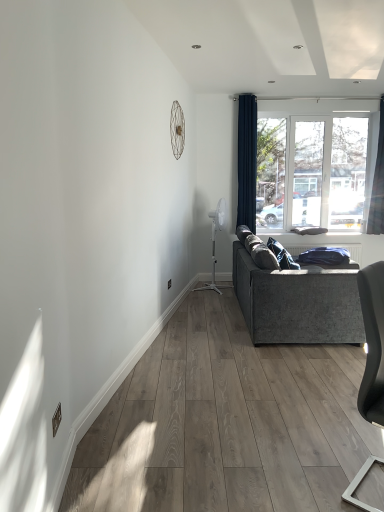
Question: In terms of width, does matte gray chair at lower right look wider or thinner when compared to navy blue fabric curtain at upper right, which is the 1th curtain from left to right?

Choices:
 (A) wide
 (B) thin

Answer: (A)

Question: Considering the positions of point (370, 461) and point (251, 112), is point (370, 461) closer or farther from the camera than point (251, 112)?

Choices:
 (A) farther
 (B) closer

Answer: (B)

Question: Based on their relative distances, which object is farther from the navy blue fabric curtain at upper right, marked as the second curtain in a right-to-left arrangement?

Choices:
 (A) matte gray chair at lower right
 (B) transparent glass window at upper right
 (C) velvet grey couch at right
 (D) dark blue fabric curtain at right, placed as the 1th curtain when sorted from right to left

Answer: (A)

Question: Which object is positioned farthest from the velvet grey couch at right?

Choices:
 (A) dark blue fabric curtain at right, placed as the 2th curtain when sorted from left to right
 (B) matte gray chair at lower right
 (C) navy blue fabric curtain at upper right, which is the 1th curtain from left to right
 (D) transparent glass window at upper right

Answer: (A)